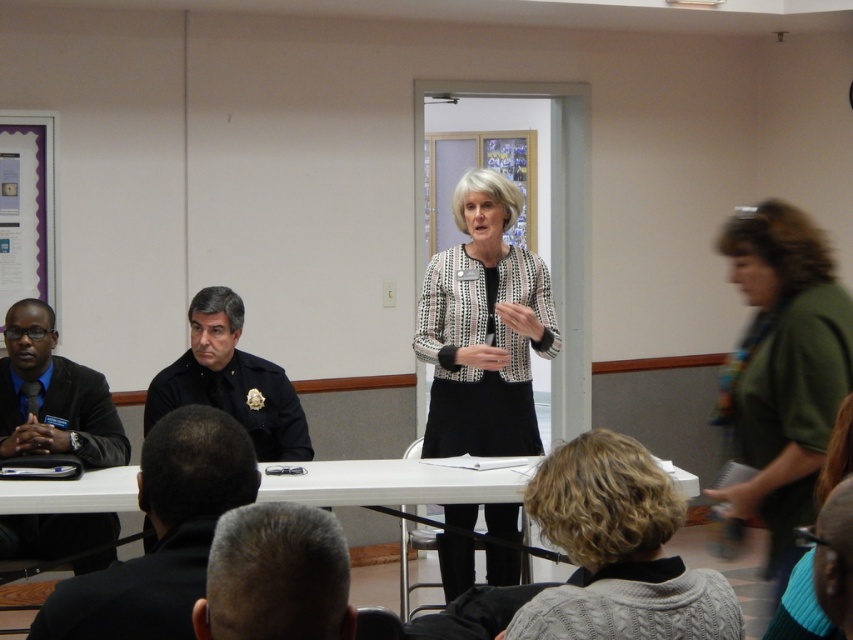
Question: Does black and white checkered jacket at center appear on the left side of white plastic table at center?

Choices:
 (A) yes
 (B) no

Answer: (B)

Question: Is green fabric jacket at right above dark blue uniform at center?

Choices:
 (A) yes
 (B) no

Answer: (A)

Question: Which point is farther from the camera taking this photo?

Choices:
 (A) (30, 368)
 (B) (212, 376)
 (C) (49, 486)

Answer: (B)

Question: Does green fabric jacket at right come in front of white plastic table at center?

Choices:
 (A) yes
 (B) no

Answer: (A)

Question: Which object appears closest to the camera in this image?

Choices:
 (A) black and white checkered jacket at center
 (B) gray hair at lower center
 (C) matte black suit at left
 (D) dark blue uniform at center

Answer: (B)

Question: Which of the following is the closest to the observer?

Choices:
 (A) dark blue uniform at center
 (B) matte black suit at left
 (C) black leather jacket at lower left

Answer: (C)